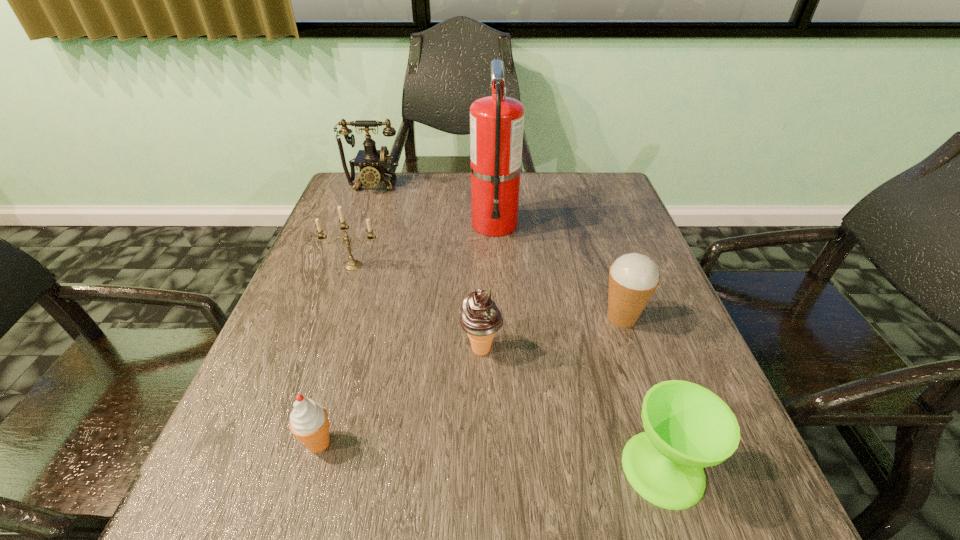
Where is `fire extinguisher`? This screenshot has width=960, height=540. fire extinguisher is located at coordinates (496, 122).

Identify the location of the tallest object. (496, 122).

You are a GUI agent. You are given a task and a screenshot of the screen. Output one action in this format:
    pyautogui.click(x=<x>, y=<y>)
    Task: Click on the farthest object
    This screenshot has width=960, height=540.
    Given the screenshot: What is the action you would take?
    pyautogui.click(x=372, y=163)

Image resolution: width=960 pixels, height=540 pixels. Identify the location of the sixth shortest object. (372, 163).

You are a GUI agent. You are given a task and a screenshot of the screen. Output one action in this format:
    pyautogui.click(x=<x>, y=<y>)
    Task: Click on the candle
    The height and width of the screenshot is (540, 960).
    Given the screenshot: What is the action you would take?
    pyautogui.click(x=352, y=265)

At what (x,y) coordinates should I click in order to perform the action: click on the second icecream from left to right. Please return your answer as a coordinate pair (x, y). Looking at the image, I should click on (480, 317).

Find the location of `the rightmost icecream`. the rightmost icecream is located at coordinates (633, 278).

At what (x,y) coordinates should I click in order to perform the action: click on wineglass. Please return your answer as a coordinate pair (x, y). Image resolution: width=960 pixels, height=540 pixels. Looking at the image, I should click on (687, 427).

The height and width of the screenshot is (540, 960). I want to click on the leftmost icecream, so click(309, 422).

You are a GUI agent. You are given a task and a screenshot of the screen. Output one action in this format:
    pyautogui.click(x=<x>, y=<y>)
    Task: Click on the nearest icecream
    
    Given the screenshot: What is the action you would take?
    pyautogui.click(x=309, y=422)